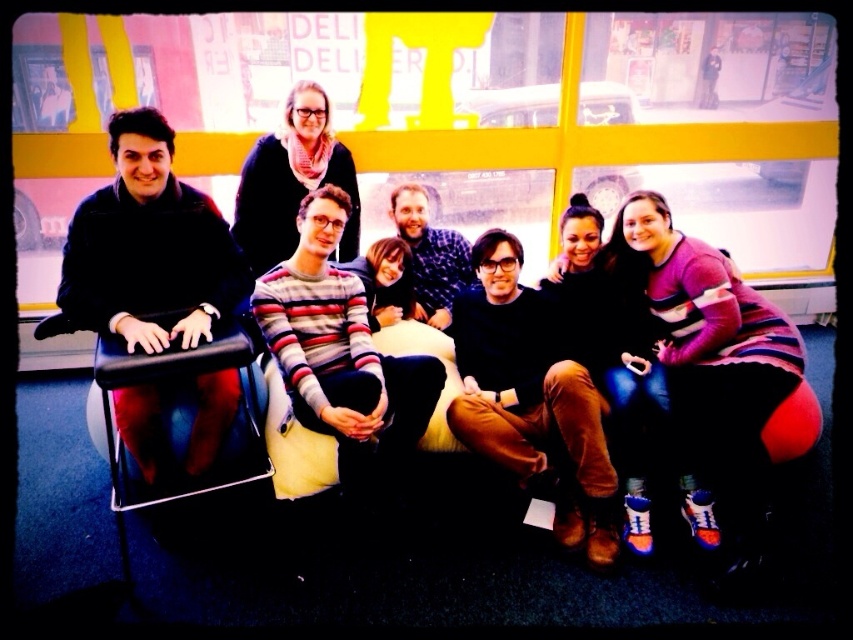
Question: Is black leather chair at left thinner than matte black sweater at upper center?

Choices:
 (A) yes
 (B) no

Answer: (B)

Question: Among these points, which one is farthest from the camera?

Choices:
 (A) (244, 220)
 (B) (230, 435)

Answer: (A)

Question: Is black leather chair at left closer to camera compared to matte black sweater at upper center?

Choices:
 (A) yes
 (B) no

Answer: (A)

Question: Does black leather chair at left appear on the left side of matte black sweater at upper center?

Choices:
 (A) yes
 (B) no

Answer: (A)